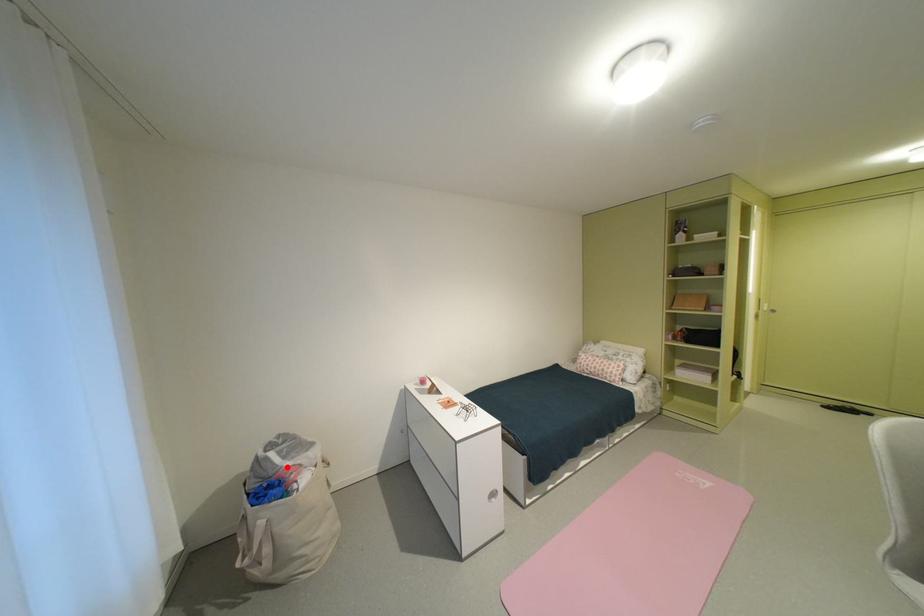
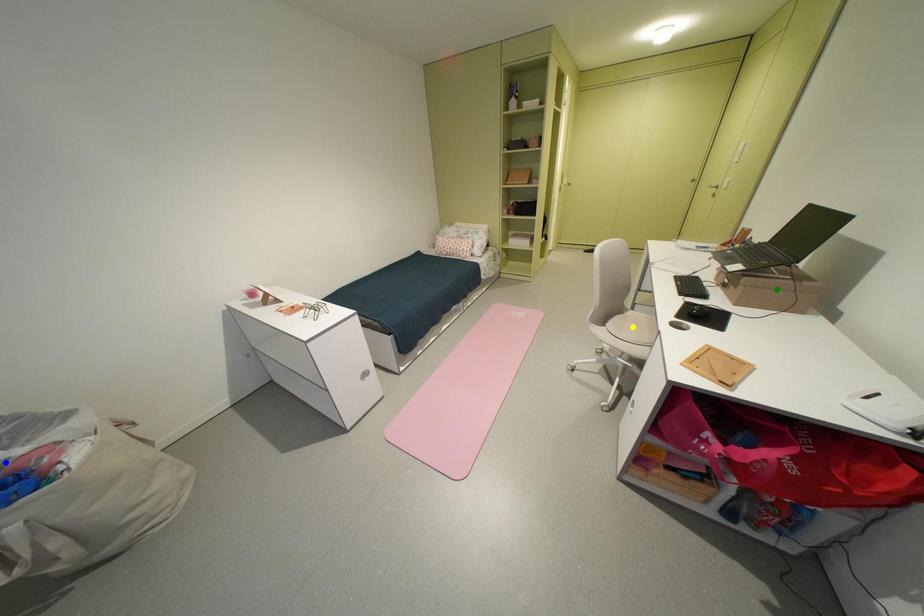
Question: I am providing you with two images of the same scene from different viewpoints. A red point is marked on the first image. You are given multiple points on the second image. In image 2, which mark is for the same physical point as the one in image 1?

Choices:
 (A) yellow point
 (B) blue point
 (C) green point

Answer: (B)